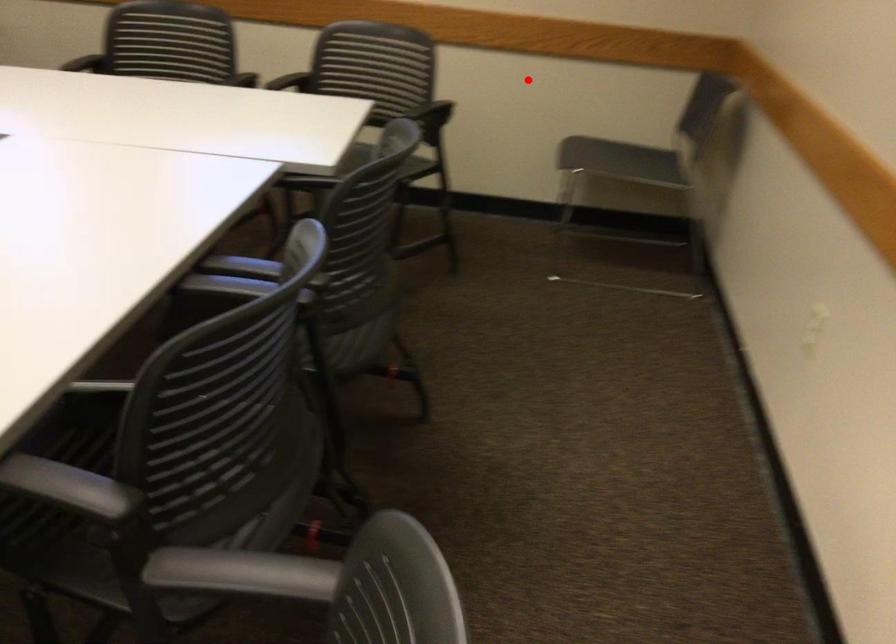
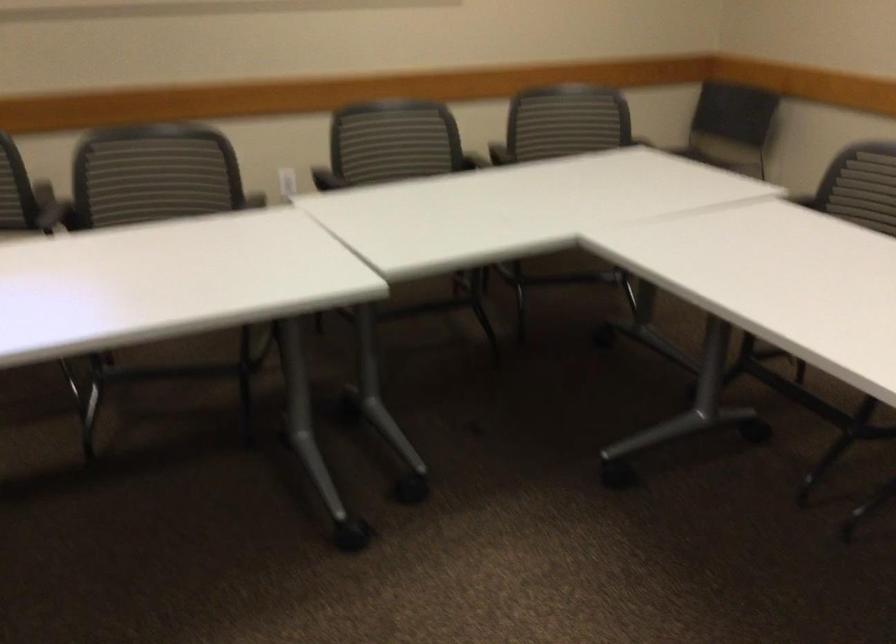
Question: I am providing you with two images of the same scene from different viewpoints. A red point is marked on the first image. At the location where the point appears in image 1, is it still visible in image 2?

Choices:
 (A) Yes
 (B) No

Answer: (A)